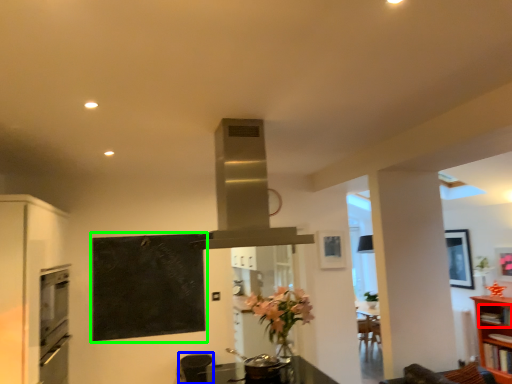
Question: Which is nearer to the shelf (highlighted by a red box)? appliance (highlighted by a blue box) or bulletin board (highlighted by a green box).

Choices:
 (A) appliance
 (B) bulletin board

Answer: (A)